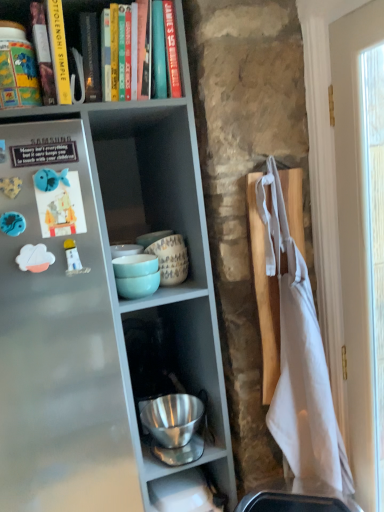
Find the location of a particular element. The image size is (384, 512). metallic gray shelf at upper left is located at coordinates (102, 306).

This screenshot has width=384, height=512. What do you see at coordinates (102, 306) in the screenshot?
I see `metallic gray shelf at upper left` at bounding box center [102, 306].

Measure the distance between point (9, 33) and camera.

A distance of 3.42 feet exists between point (9, 33) and camera.

This screenshot has height=512, width=384. What do you see at coordinates (59, 52) in the screenshot?
I see `hardcover book at upper left` at bounding box center [59, 52].

Locate an element on the screen. hardcover book at upper left is located at coordinates (59, 52).

The height and width of the screenshot is (512, 384). Identify the location of metallic gray shelf at upper left. (102, 306).

Is metallic gray shelf at upper left to the left of hardcover book at upper left from the viewer's perspective?

Yes, metallic gray shelf at upper left is to the left of hardcover book at upper left.

Is metallic gray shelf at upper left in front of or behind hardcover book at upper left in the image?

metallic gray shelf at upper left is positioned closer to the viewer than hardcover book at upper left.

Which point is more forward, (49,201) or (7,32)?

The point (49,201) is closer.

From the image's perspective, relative to hardcover book at upper left, is metallic gray shelf at upper left above or below?

Based on their image positions, metallic gray shelf at upper left is located beneath hardcover book at upper left.

From a real-world perspective, is metallic gray shelf at upper left physically above hardcover book at upper left?

Actually, metallic gray shelf at upper left is physically below hardcover book at upper left in the real world.

Consider the image. Which object is thinner, metallic gray shelf at upper left or hardcover book at upper left?

Thinner between the two is hardcover book at upper left.

Which of these two, metallic gray shelf at upper left or hardcover book at upper left, stands shorter?

Standing shorter between the two is hardcover book at upper left.

Considering the sizes of objects metallic gray shelf at upper left and hardcover book at upper left in the image provided, who is smaller, metallic gray shelf at upper left or hardcover book at upper left?

hardcover book at upper left is smaller.

Would you say metallic gray shelf at upper left is inside or outside hardcover book at upper left?

metallic gray shelf at upper left is not inside hardcover book at upper left, it's outside.

Is metallic gray shelf at upper left not near hardcover book at upper left?

No.

Is metallic gray shelf at upper left oriented away from hardcover book at upper left?

metallic gray shelf at upper left does not have its back to hardcover book at upper left.

Can you tell me how much metallic gray shelf at upper left and hardcover book at upper left differ in facing direction?

The angular difference between metallic gray shelf at upper left and hardcover book at upper left is 1.33 degrees.

How distant is metallic gray shelf at upper left from hardcover book at upper left?

They are 21.38 inches apart.

You are a GUI agent. You are given a task and a screenshot of the screen. Output one action in this format:
    pyautogui.click(x=<x>, y=<y>)
    Task: Click on the book lying behind the metallic gray shelf at upper left
    This screenshot has width=384, height=512.
    Given the screenshot: What is the action you would take?
    pyautogui.click(x=59, y=52)

Between hardcover book at upper left and metallic gray shelf at upper left, which one appears on the left side from the viewer's perspective?

From the viewer's perspective, metallic gray shelf at upper left appears more on the left side.

Is hardcover book at upper left positioned in front of metallic gray shelf at upper left?

No, the depth of hardcover book at upper left is greater than that of metallic gray shelf at upper left.

Which is closer, [73,88] or [20,371]?

Point [73,88] appears to be farther away from the viewer than point [20,371].

From the image's perspective, who appears lower, hardcover book at upper left or metallic gray shelf at upper left?

From the image's view, metallic gray shelf at upper left is below.

From a real-world perspective, does hardcover book at upper left stand above metallic gray shelf at upper left?

Yes, from a real-world perspective, hardcover book at upper left is above metallic gray shelf at upper left.

In the scene shown: Considering the sizes of objects hardcover book at upper left and metallic gray shelf at upper left in the image provided, who is wider, hardcover book at upper left or metallic gray shelf at upper left?

Wider between the two is metallic gray shelf at upper left.

Can you confirm if hardcover book at upper left is taller than metallic gray shelf at upper left?

In fact, hardcover book at upper left may be shorter than metallic gray shelf at upper left.

Which of these two, hardcover book at upper left or metallic gray shelf at upper left, is smaller?

hardcover book at upper left is smaller.

Is metallic gray shelf at upper left a part of hardcover book at upper left?

No.

Is hardcover book at upper left far away from metallic gray shelf at upper left?

No, there isn't a large distance between hardcover book at upper left and metallic gray shelf at upper left.

Is hardcover book at upper left positioned with its back to metallic gray shelf at upper left?

Correct, hardcover book at upper left is looking away from metallic gray shelf at upper left.

From the picture: How many degrees apart are the facing directions of hardcover book at upper left and metallic gray shelf at upper left?

There is a 1.33-degree angle between the facing directions of hardcover book at upper left and metallic gray shelf at upper left.

Identify the location of shelf below the hardcover book at upper left (from the image's perspective). (102, 306).

This screenshot has width=384, height=512. There is a metallic gray shelf at upper left. In order to click on book above it (from a real-world perspective) in this screenshot , I will do `click(59, 52)`.

Find the location of `book behind the metallic gray shelf at upper left`. book behind the metallic gray shelf at upper left is located at coordinates (59, 52).